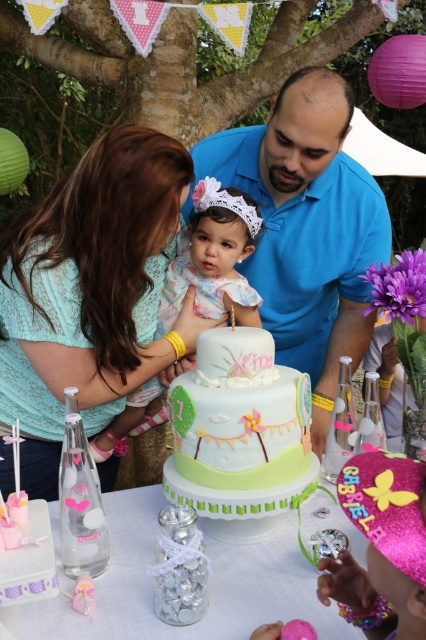
Does point (143, 180) lie behind point (298, 170)?

No, (143, 180) is in front of (298, 170).

Does matte teal lace dress at upper left appear on the left side of blue smooth shirt at center?

Yes, matte teal lace dress at upper left is to the left of blue smooth shirt at center.

This screenshot has width=426, height=640. Describe the element at coordinates (89, 292) in the screenshot. I see `matte teal lace dress at upper left` at that location.

The width and height of the screenshot is (426, 640). I want to click on matte teal lace dress at upper left, so click(89, 292).

Describe the element at coordinates (89, 292) in the screenshot. I see `matte teal lace dress at upper left` at that location.

Who is shorter, matte teal lace dress at upper left or pastel fondant cake at center?

With less height is pastel fondant cake at center.

Locate an element on the screen. This screenshot has width=426, height=640. matte teal lace dress at upper left is located at coordinates (89, 292).

Is matte green cake at center smaller than pastel floral dress at center?

Yes.

Where is `matte green cake at center`? Image resolution: width=426 pixels, height=640 pixels. matte green cake at center is located at coordinates [209, 586].